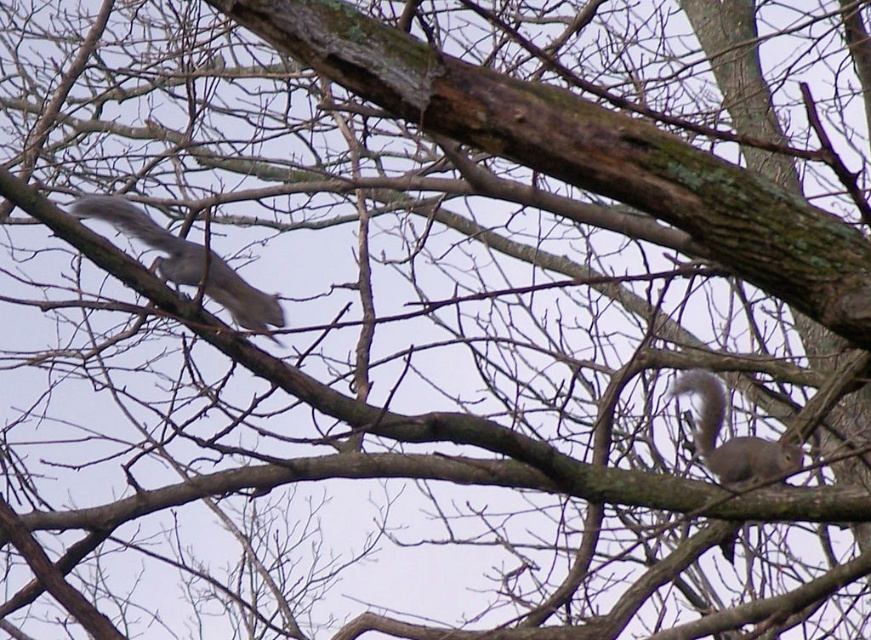
Question: Which point is farther to the camera?

Choices:
 (A) (488, 90)
 (B) (755, 477)
 (C) (127, 204)

Answer: (B)

Question: Which of the following is the closest to the observer?

Choices:
 (A) gray furry squirrel at left
 (B) gray furry squirrel at right
 (C) brown rough bark at center
 (D) white fluffy tail at right

Answer: (C)

Question: Can you confirm if gray furry squirrel at left is thinner than gray furry squirrel at right?

Choices:
 (A) yes
 (B) no

Answer: (B)

Question: Can you confirm if brown rough bark at center is bigger than gray furry squirrel at right?

Choices:
 (A) no
 (B) yes

Answer: (A)

Question: Based on their relative distances, which object is farther from the gray furry squirrel at left?

Choices:
 (A) gray furry squirrel at right
 (B) brown rough bark at center
 (C) white fluffy tail at right

Answer: (C)

Question: Does gray furry squirrel at left have a larger size compared to white fluffy tail at right?

Choices:
 (A) no
 (B) yes

Answer: (B)